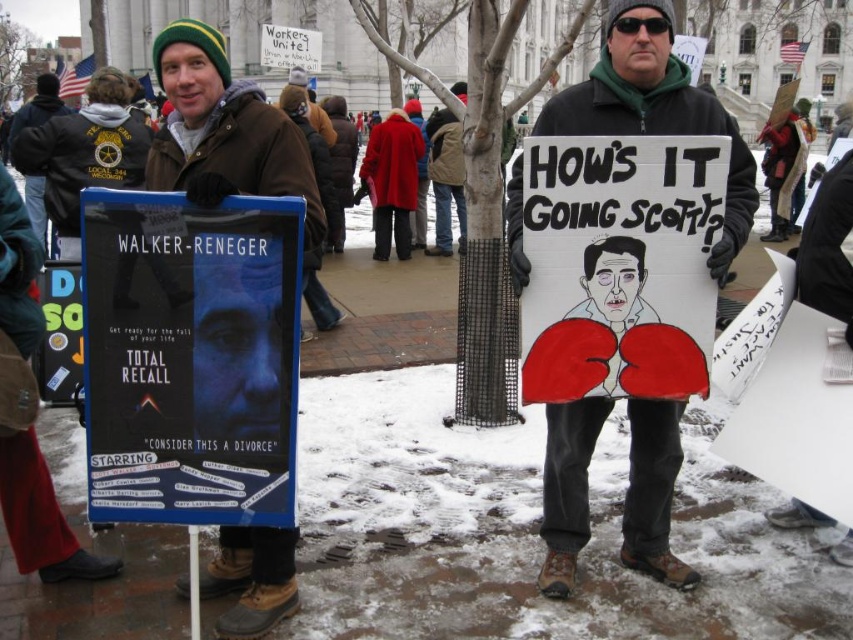
Question: Can you confirm if blue cardboard poster at center-left is positioned to the left of brown leather jacket at center?

Choices:
 (A) yes
 (B) no

Answer: (A)

Question: In this image, where is blue cardboard poster at center-left located relative to white cardboard sign at center?

Choices:
 (A) right
 (B) left

Answer: (B)

Question: Which object appears farthest from the camera in this image?

Choices:
 (A) brown leather jacket at center
 (B) matte black sign at center
 (C) blue cardboard poster at center-left
 (D) white cardboard sign at center

Answer: (B)

Question: Can you confirm if blue cardboard poster at center-left is positioned to the left of brown leather jacket at center?

Choices:
 (A) yes
 (B) no

Answer: (A)

Question: Which point is farther to the camera?

Choices:
 (A) blue cardboard poster at center-left
 (B) white cardboard sign at center
 (C) matte black sign at center
 (D) brown leather jacket at center

Answer: (C)

Question: Which of the following is the closest to the observer?

Choices:
 (A) brown leather jacket at center
 (B) white cardboard sign at center
 (C) matte black sign at center
 (D) blue cardboard poster at center-left

Answer: (D)